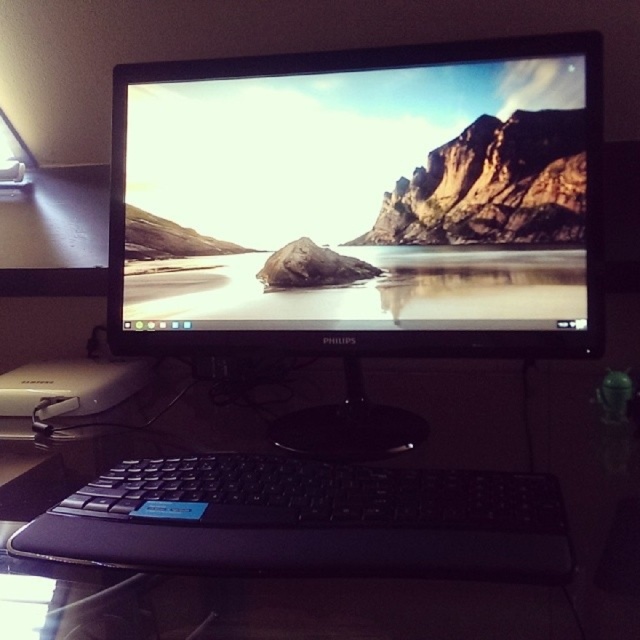
Between black glossy monitor at center and black plastic keyboard at center, which one is positioned lower?

Positioned lower is black plastic keyboard at center.

The width and height of the screenshot is (640, 640). Find the location of `black glossy monitor at center`. black glossy monitor at center is located at coordinates (362, 200).

Is black plastic keyboard at lower center behind black plastic keyboard at center?

No, it is not.

Does black plastic keyboard at lower center have a smaller size compared to black plastic keyboard at center?

No.

What are the coordinates of `black plastic keyboard at lower center` in the screenshot? It's located at (381, 577).

The width and height of the screenshot is (640, 640). I want to click on black plastic keyboard at lower center, so click(381, 577).

Which is behind, point (416, 52) or point (504, 392)?

The point (504, 392) is behind.

From the picture: Does black glossy monitor at center appear on the right side of black plastic keyboard at lower center?

No, black glossy monitor at center is not to the right of black plastic keyboard at lower center.

Identify the location of black glossy monitor at center. (362, 200).